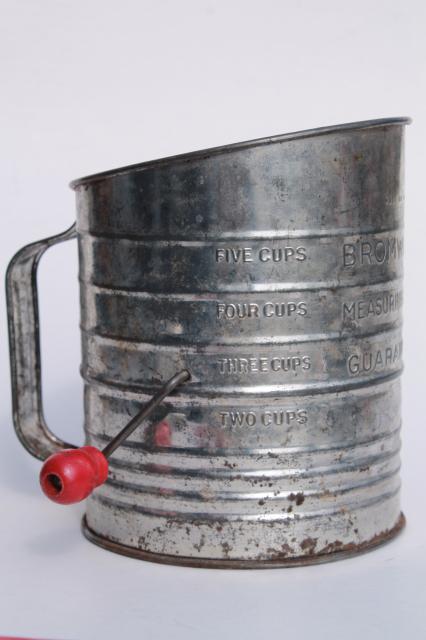
The image size is (426, 640). Find the location of `handle`. handle is located at coordinates (17, 347).